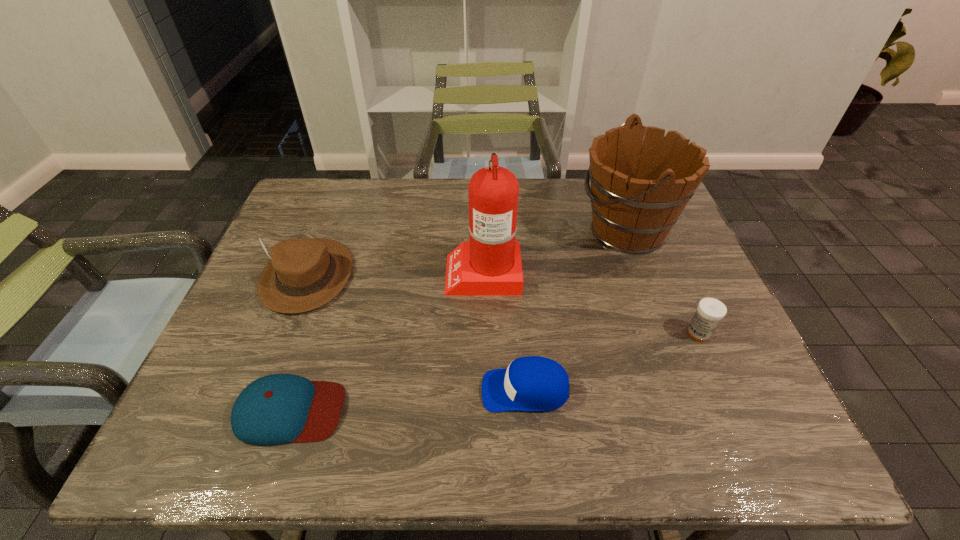
At what (x,y) coordinates should I click in order to perform the action: click on fire extinguisher. Please return your answer as a coordinate pair (x, y). This screenshot has height=540, width=960. Looking at the image, I should click on (490, 264).

This screenshot has height=540, width=960. I want to click on the fifth shortest object, so click(639, 188).

Where is `fedora`? The image size is (960, 540). fedora is located at coordinates (303, 274).

The height and width of the screenshot is (540, 960). Find the location of `the fourth farthest object`. the fourth farthest object is located at coordinates (710, 311).

You are a GUI agent. You are given a task and a screenshot of the screen. Output one action in this format:
    pyautogui.click(x=<x>, y=<y>)
    Task: Click on the fourth tallest object
    Image resolution: width=960 pixels, height=540 pixels.
    Given the screenshot: What is the action you would take?
    pyautogui.click(x=710, y=311)

At what (x,y) coordinates should I click in order to perform the action: click on the right baseball cap. Please return your answer as a coordinate pair (x, y). Looking at the image, I should click on (532, 383).

Image resolution: width=960 pixels, height=540 pixels. I want to click on the shorter baseball cap, so click(279, 408).

Locate an element on the screen. The width and height of the screenshot is (960, 540). the left baseball cap is located at coordinates (279, 408).

Where is `vacant space located 0.260m on the front-facing side of the fire extinguisher`? The width and height of the screenshot is (960, 540). vacant space located 0.260m on the front-facing side of the fire extinguisher is located at coordinates (348, 272).

Locate an element on the screen. This screenshot has height=540, width=960. vacant space located on the front-facing side of the fire extinguisher is located at coordinates (307, 272).